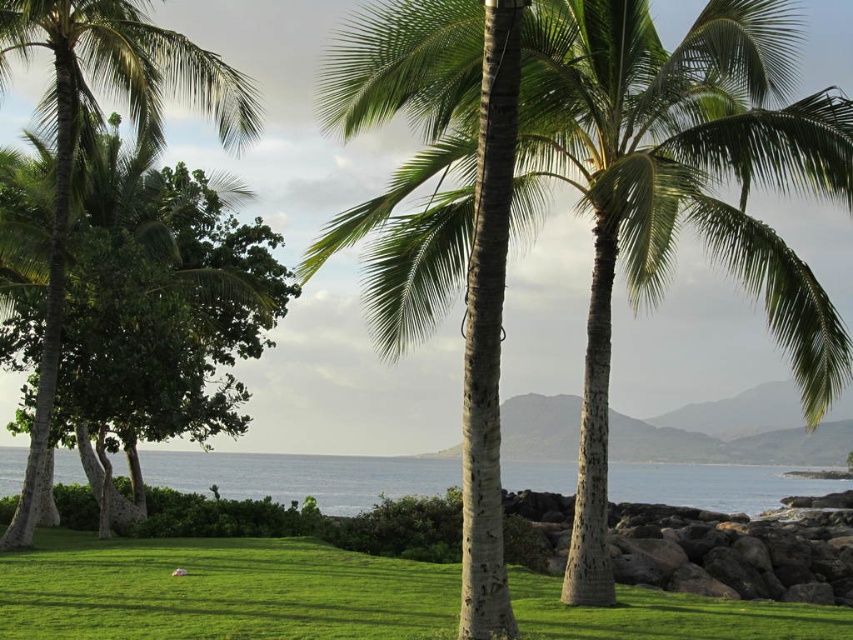
Question: Can you confirm if green leafy coconut trees at center is bigger than green leafy palm tree at left?

Choices:
 (A) no
 (B) yes

Answer: (B)

Question: Does green leafy coconut trees at center have a lesser width compared to green grass at center?

Choices:
 (A) no
 (B) yes

Answer: (A)

Question: Is green leafy coconut trees at center wider than blue water at center?

Choices:
 (A) yes
 (B) no

Answer: (B)

Question: Which point is closer to the camera?

Choices:
 (A) (167, 484)
 (B) (114, 16)
 (C) (412, 564)
 (D) (634, 177)

Answer: (D)

Question: Which point appears farthest from the camera in this image?

Choices:
 (A) (x=74, y=26)
 (B) (x=122, y=563)
 (C) (x=518, y=483)

Answer: (C)

Question: Which object is the closest to the blue water at center?

Choices:
 (A) green grass at center
 (B) green leafy coconut trees at center
 (C) green leafy palm tree at left

Answer: (C)